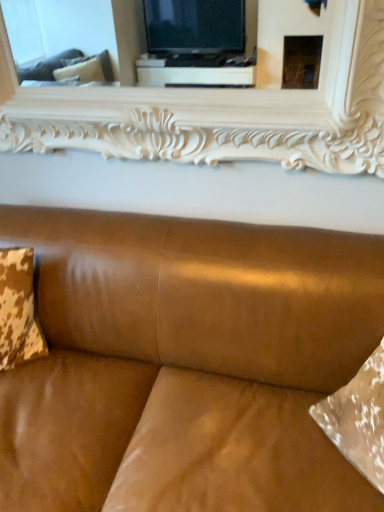
Question: Is satin brown leather couch at center facing away from cowhide fabric pillow at left?

Choices:
 (A) yes
 (B) no

Answer: (A)

Question: Is satin brown leather couch at center taller than cowhide fabric pillow at left?

Choices:
 (A) no
 (B) yes

Answer: (B)

Question: Does satin brown leather couch at center turn towards cowhide fabric pillow at left?

Choices:
 (A) no
 (B) yes

Answer: (B)

Question: Can you confirm if satin brown leather couch at center is bigger than cowhide fabric pillow at left?

Choices:
 (A) yes
 (B) no

Answer: (A)

Question: Is satin brown leather couch at center not close to cowhide fabric pillow at left?

Choices:
 (A) no
 (B) yes

Answer: (A)

Question: Based on their sizes in the image, would you say white carved wood mirror at upper center is bigger or smaller than satin brown leather couch at center?

Choices:
 (A) small
 (B) big

Answer: (A)

Question: Is white carved wood mirror at upper center taller or shorter than satin brown leather couch at center?

Choices:
 (A) short
 (B) tall

Answer: (A)

Question: Does point (311, 152) appear closer or farther from the camera than point (241, 313)?

Choices:
 (A) closer
 (B) farther

Answer: (B)

Question: Considering the positions of white carved wood mirror at upper center and satin brown leather couch at center in the image, is white carved wood mirror at upper center wider or thinner than satin brown leather couch at center?

Choices:
 (A) thin
 (B) wide

Answer: (A)

Question: Does point (261, 419) appear closer or farther from the camera than point (4, 345)?

Choices:
 (A) closer
 (B) farther

Answer: (A)

Question: Which is correct: satin brown leather couch at center is inside cowhide fabric pillow at left, or outside of it?

Choices:
 (A) inside
 (B) outside

Answer: (B)

Question: Considering the positions of satin brown leather couch at center and cowhide fabric pillow at left in the image, is satin brown leather couch at center bigger or smaller than cowhide fabric pillow at left?

Choices:
 (A) big
 (B) small

Answer: (A)

Question: Looking at their shapes, would you say satin brown leather couch at center is wider or thinner than cowhide fabric pillow at left?

Choices:
 (A) thin
 (B) wide

Answer: (B)

Question: Choose the correct answer: Is cowhide fabric pillow at left inside white carved wood mirror at upper center or outside it?

Choices:
 (A) inside
 (B) outside

Answer: (B)

Question: Is cowhide fabric pillow at left to the left or to the right of white carved wood mirror at upper center in the image?

Choices:
 (A) left
 (B) right

Answer: (A)